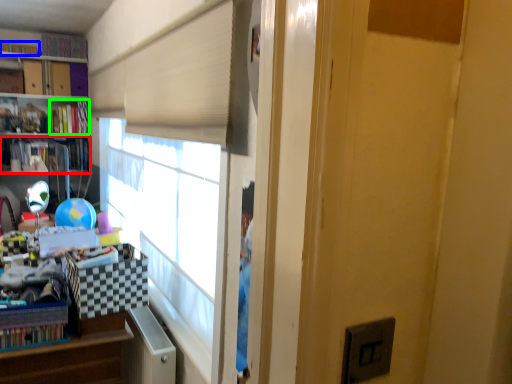
Question: Considering the real-world distances, which object is closest to book (highlighted by a red box)? book (highlighted by a blue box) or book (highlighted by a green box).

Choices:
 (A) book
 (B) book

Answer: (B)